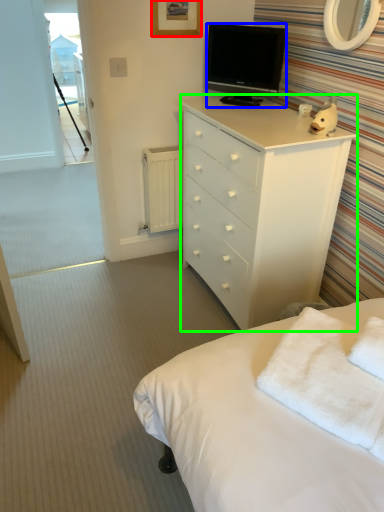
Question: Considering the real-world distances, which object is farthest from picture frame (highlighted by a red box)? television (highlighted by a blue box) or chest of drawers (highlighted by a green box)?

Choices:
 (A) television
 (B) chest of drawers

Answer: (B)